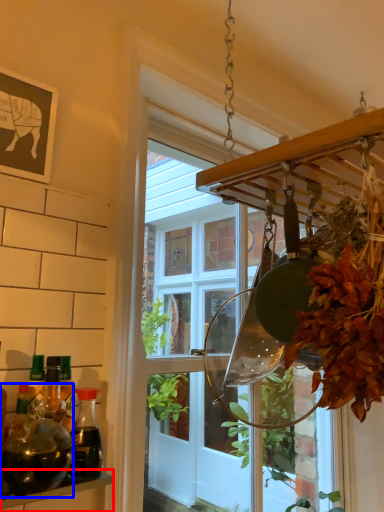
Question: Which of the following is the closest to the observer, shelf (highlighted by a red box) or bottle (highlighted by a blue box)?

Choices:
 (A) shelf
 (B) bottle

Answer: (A)